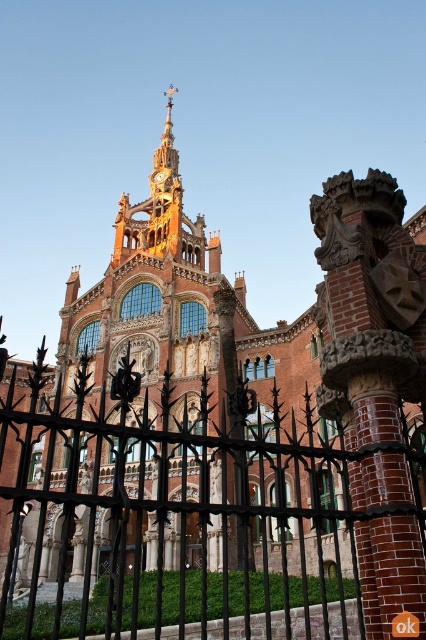
Question: Is black wrought iron fence at center further to camera compared to gold metallic clock at center?

Choices:
 (A) yes
 (B) no

Answer: (B)

Question: Does black wrought iron fence at center appear under gold metallic clock at center?

Choices:
 (A) yes
 (B) no

Answer: (A)

Question: Which point is closer to the camera taking this photo?

Choices:
 (A) (155, 179)
 (B) (279, 422)

Answer: (B)

Question: Is black wrought iron fence at center further to camera compared to gold metallic clock at center?

Choices:
 (A) yes
 (B) no

Answer: (B)